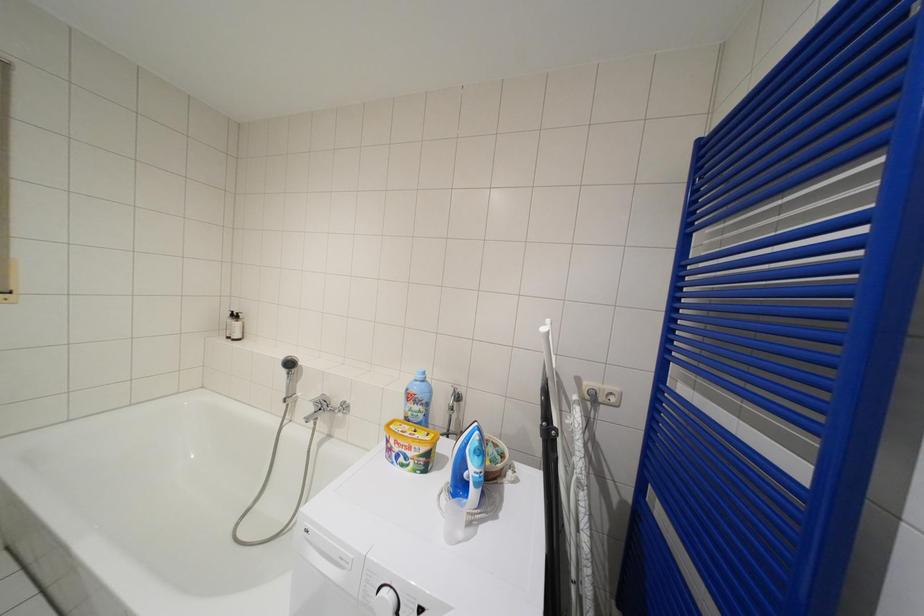
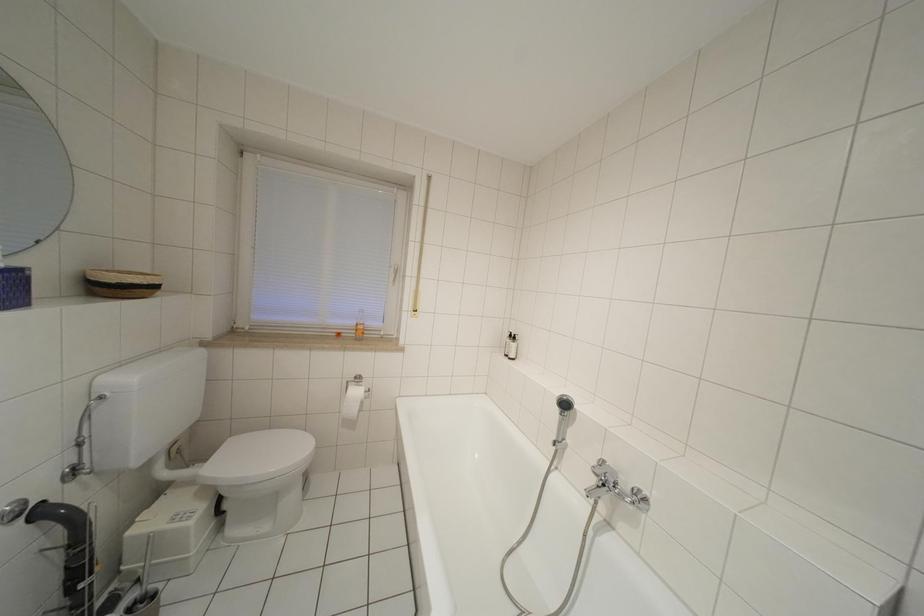
Question: The camera is either moving clockwise (left) or counter-clockwise (right) around the object. The first image is from the beginning of the video and the second image is from the end. Is the camera moving left or right when shooting the video?

Choices:
 (A) Left
 (B) Right

Answer: (B)